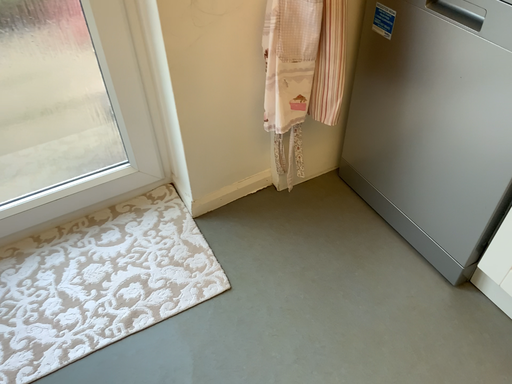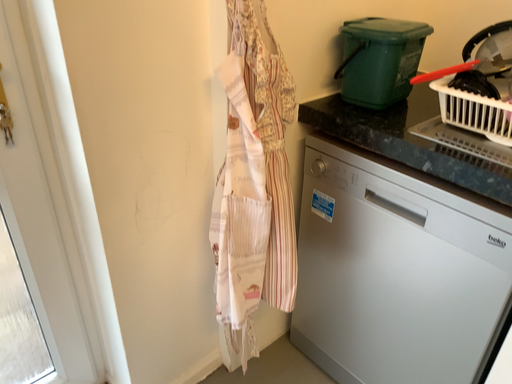
Question: How did the camera likely rotate when shooting the video?

Choices:
 (A) rotated left
 (B) rotated right

Answer: (B)